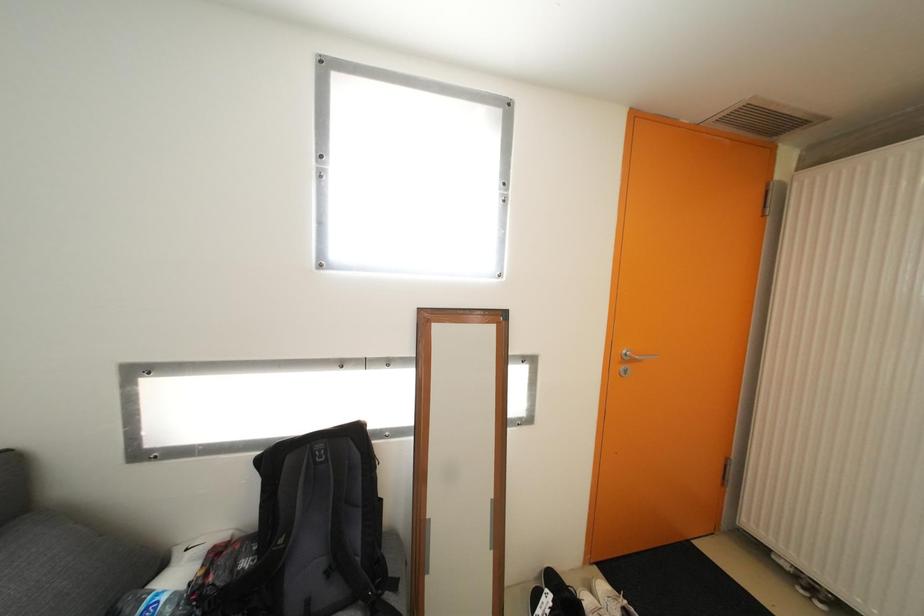
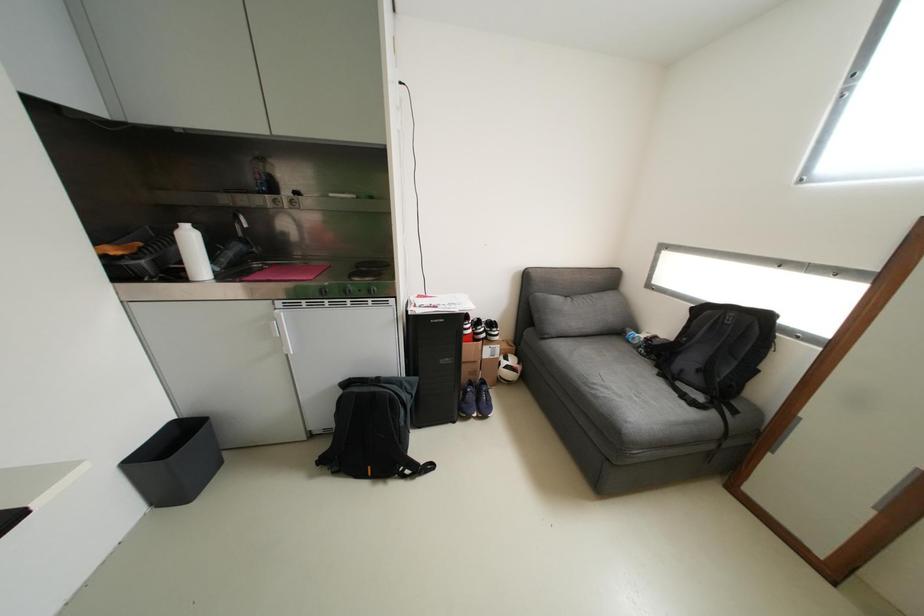
First-person continuous shooting, in which direction is the camera rotating?

The camera rotated toward left-down.